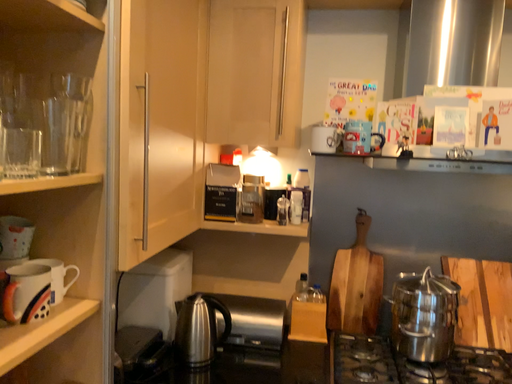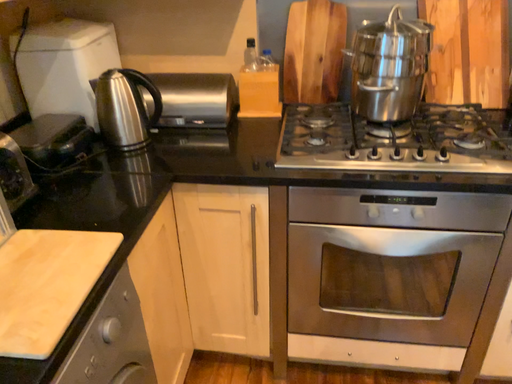
Question: Which way did the camera rotate in the video?

Choices:
 (A) rotated downward
 (B) rotated upward

Answer: (A)